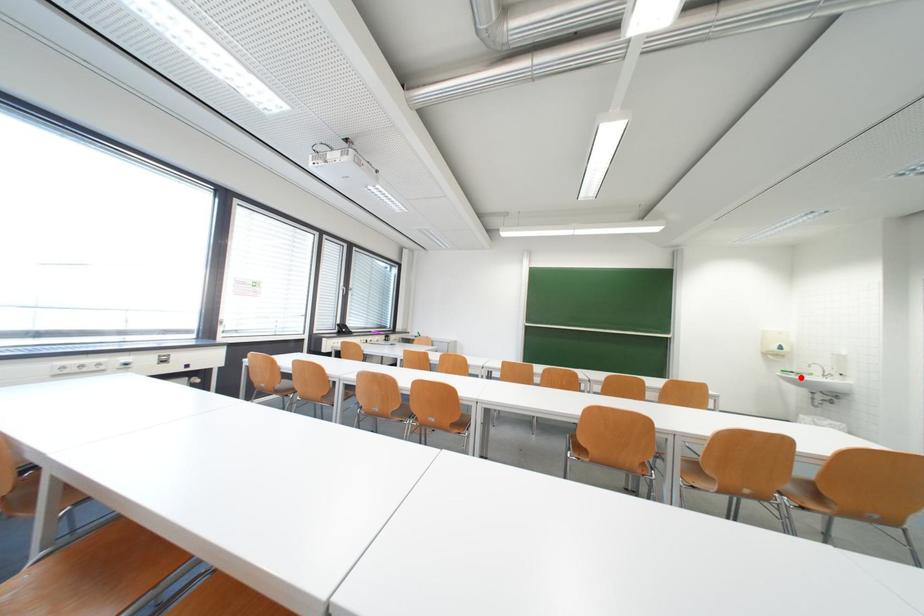
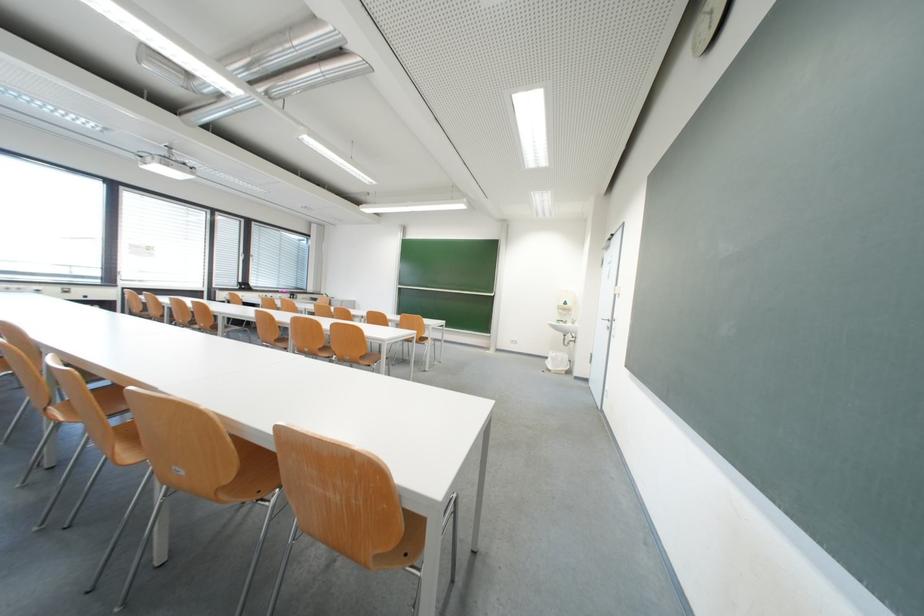
The point at the highlighted location is marked in the first image. Where is the corresponding point in the second image?

(570, 326)